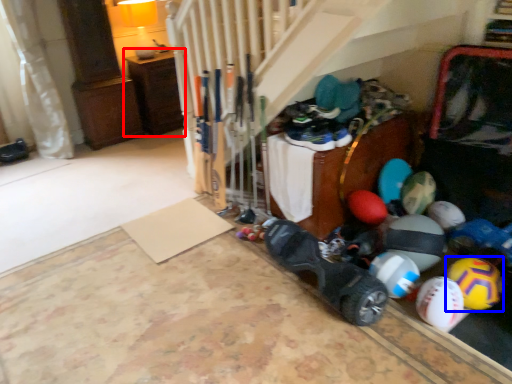
Question: Which object appears closest to the camera in this image, furniture (highlighted by a red box) or beach ball (highlighted by a blue box)?

Choices:
 (A) furniture
 (B) beach ball

Answer: (B)